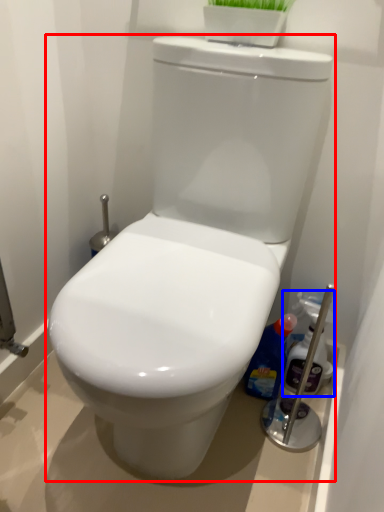
Question: Among these objects, which one is farthest to the camera, toilet (highlighted by a red box) or cleaning product (highlighted by a blue box)?

Choices:
 (A) toilet
 (B) cleaning product

Answer: (B)